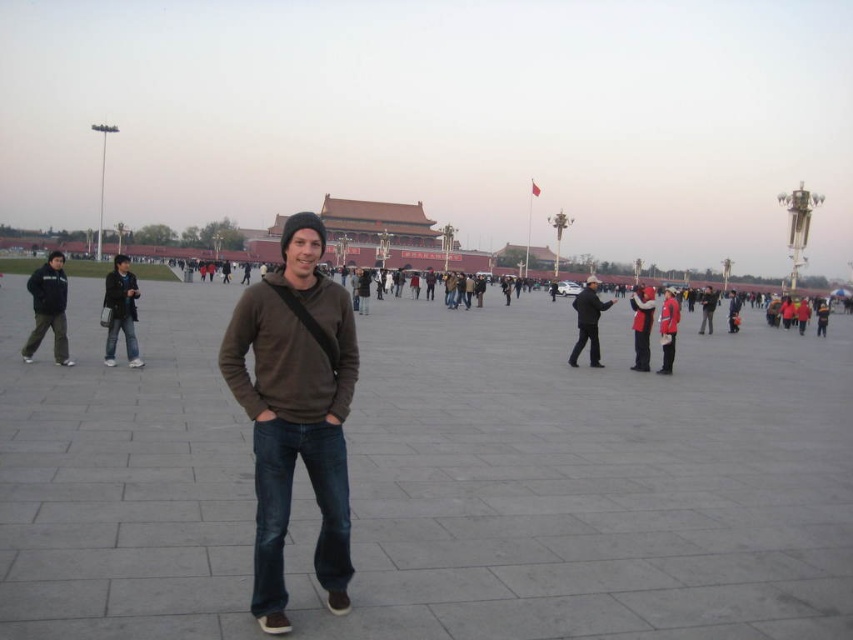
In the scene shown: Does brown cotton sweater at center have a lesser width compared to dark gray fleece jacket at left?

Yes, brown cotton sweater at center is thinner than dark gray fleece jacket at left.

The width and height of the screenshot is (853, 640). Find the location of `brown cotton sweater at center`. brown cotton sweater at center is located at coordinates (294, 410).

Identify the location of brown cotton sweater at center. (294, 410).

Does brown cotton sweater at center have a greater height compared to dark gray jeans at left?

Indeed, brown cotton sweater at center has a greater height compared to dark gray jeans at left.

Is brown cotton sweater at center positioned at the back of dark gray jeans at left?

No, brown cotton sweater at center is closer to the viewer.

Which is behind, point (323, 346) or point (103, 307)?

Point (103, 307)

At what (x,y) coordinates should I click in order to perform the action: click on brown cotton sweater at center. Please return your answer as a coordinate pair (x, y). This screenshot has width=853, height=640. Looking at the image, I should click on coord(294,410).

Is reddish-brown stone palace at center in front of red fabric jacket at center?

Yes, reddish-brown stone palace at center is closer to the viewer.

Is reddish-brown stone palace at center thinner than red fabric jacket at center?

Incorrect, reddish-brown stone palace at center's width is not less than red fabric jacket at center's.

Does point (425, 225) come farther from viewer compared to point (664, 305)?

That is True.

In order to click on reddish-brown stone palace at center in this screenshot , I will do 392,237.